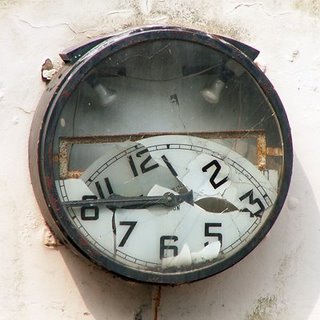
The image size is (320, 320). In order to click on clock in this screenshot , I will do `click(278, 113)`.